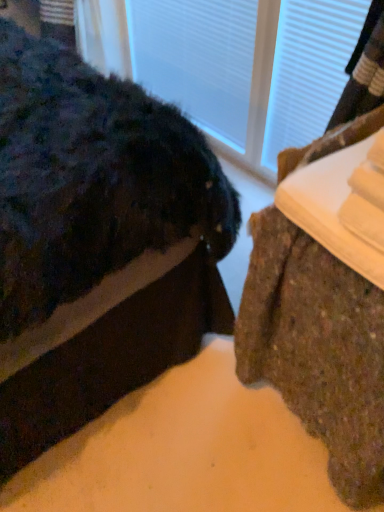
Question: Would you say brown textured rug at lower right, marked as the 1th furniture in a right-to-left arrangement, is to the left or to the right of transparent glass door at upper center in the picture?

Choices:
 (A) left
 (B) right

Answer: (B)

Question: Is point (244, 317) closer or farther from the camera than point (339, 60)?

Choices:
 (A) closer
 (B) farther

Answer: (A)

Question: Which object is the farthest from the brown textured rug at lower right, marked as the 1th furniture in a right-to-left arrangement?

Choices:
 (A) transparent glass door at upper center
 (B) brown textured rug at lower right, the 2th furniture positioned from the right

Answer: (A)

Question: Estimate the real-world distances between objects in this image. Which object is farther from the transparent glass door at upper center?

Choices:
 (A) brown textured rug at lower right, the 2th furniture positioned from the right
 (B) brown textured rug at lower right, marked as the 1th furniture in a right-to-left arrangement

Answer: (B)